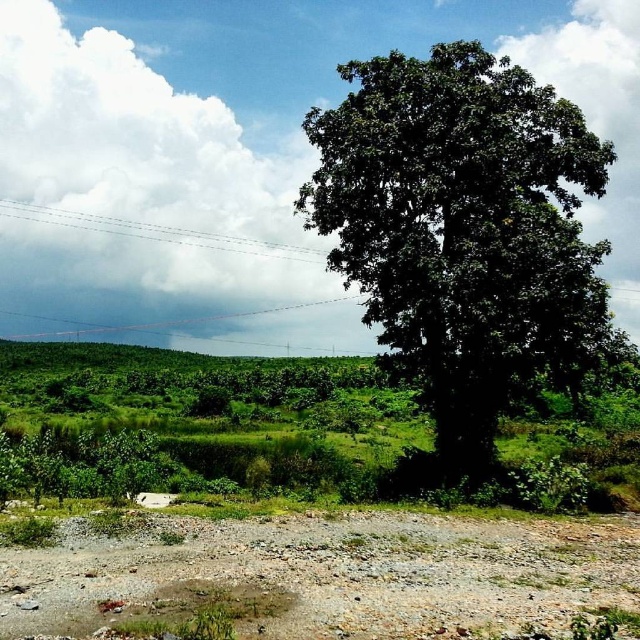
You are a gardener planning to plant a new flower bed. You have two options for locations in the image provided. The first is near the green leafy tree at right, and the second is near the dull brown gravel at lower center. Based on the spatial arrangement, which location is to the left of the other?

The dull brown gravel at lower center is to the left of the green leafy tree at right.